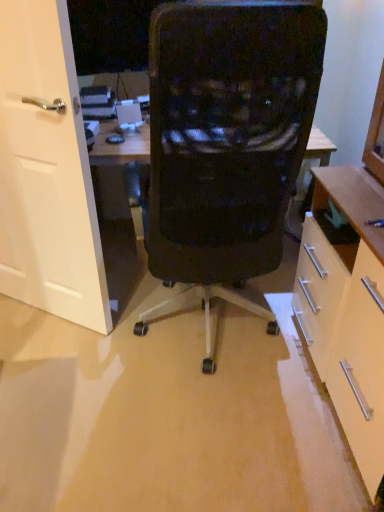
The width and height of the screenshot is (384, 512). What are the coordinates of `white matte door at left` in the screenshot? It's located at (46, 170).

Can we say black mesh chair at center lies outside matte white cabinet at right?

black mesh chair at center lies outside matte white cabinet at right's area.

Considering the positions of objects black mesh chair at center and matte white cabinet at right in the image provided, who is more to the left, black mesh chair at center or matte white cabinet at right?

black mesh chair at center.

From a real-world perspective, who is located lower, black mesh chair at center or matte white cabinet at right?

black mesh chair at center, from a real-world perspective.

Image resolution: width=384 pixels, height=512 pixels. In the image, there is a matte white cabinet at right. Identify the location of chair above it (from the image's perspective). (227, 140).

Is white matte door at left far from matte white cabinet at right?

No.

Can you confirm if white matte door at left is wider than matte white cabinet at right?

No, white matte door at left is not wider than matte white cabinet at right.

Which of these two, white matte door at left or matte white cabinet at right, stands shorter?

matte white cabinet at right is shorter.

Is white matte door at left facing away from matte white cabinet at right?

No, white matte door at left's orientation is not away from matte white cabinet at right.

Can you confirm if matte white cabinet at right is wider than white matte door at left?

Indeed, matte white cabinet at right has a greater width compared to white matte door at left.

From a real-world perspective, is matte white cabinet at right positioned over white matte door at left based on gravity?

Indeed, from a real-world perspective, matte white cabinet at right stands above white matte door at left.

The width and height of the screenshot is (384, 512). Find the location of `cabinetry on the right of white matte door at left`. cabinetry on the right of white matte door at left is located at coordinates (347, 308).

You are a GUI agent. You are given a task and a screenshot of the screen. Output one action in this format:
    pyautogui.click(x=<x>, y=<y>)
    Task: Click on the door that appears above the black mesh chair at center (from the image's perspective)
    The width and height of the screenshot is (384, 512).
    Given the screenshot: What is the action you would take?
    pyautogui.click(x=46, y=170)

From a real-world perspective, which is physically below, white matte door at left or black mesh chair at center?

white matte door at left is physically lower.

Can you tell me how much white matte door at left and black mesh chair at center differ in facing direction?

147 degrees.

Can you confirm if white matte door at left is shorter than black mesh chair at center?

Yes, white matte door at left is shorter than black mesh chair at center.

Considering the positions of points (262, 240) and (32, 193), is point (262, 240) closer to camera compared to point (32, 193)?

Yes, it is in front of point (32, 193).

Considering the sizes of objects black mesh chair at center and white matte door at left in the image provided, who is bigger, black mesh chair at center or white matte door at left?

Bigger between the two is black mesh chair at center.

From a real-world perspective, is black mesh chair at center physically above white matte door at left?

Yes.

How different are the orientations of matte white cabinet at right and black mesh chair at center in degrees?

The facing directions of matte white cabinet at right and black mesh chair at center are 89.3 degrees apart.

Is matte white cabinet at right thinner than black mesh chair at center?

Indeed, matte white cabinet at right has a lesser width compared to black mesh chair at center.

Looking at this image, is matte white cabinet at right facing towards black mesh chair at center?

Yes, matte white cabinet at right faces towards black mesh chair at center.

This screenshot has width=384, height=512. Identify the location of cabinetry located below the black mesh chair at center (from the image's perspective). (347, 308).

Find the location of a particular element. cabinetry located on the right of black mesh chair at center is located at coordinates (347, 308).

Locate an element on the screen. cabinetry lying in front of the white matte door at left is located at coordinates (347, 308).

Which object lies further to the anchor point white matte door at left, black mesh chair at center or matte white cabinet at right?

Based on the image, matte white cabinet at right appears to be further to white matte door at left.

Considering their positions, is black mesh chair at center positioned further to matte white cabinet at right than white matte door at left?

white matte door at left.

From the image, which object appears to be nearer to white matte door at left, matte white cabinet at right or black mesh chair at center?

Based on the image, black mesh chair at center appears to be nearer to white matte door at left.

From the image, which object appears to be farther from black mesh chair at center, matte white cabinet at right or white matte door at left?

The object further to black mesh chair at center is white matte door at left.

Estimate the real-world distances between objects in this image. Which object is closer to matte white cabinet at right, white matte door at left or black mesh chair at center?

Among the two, black mesh chair at center is located nearer to matte white cabinet at right.

From the image, which object appears to be nearer to black mesh chair at center, white matte door at left or matte white cabinet at right?

The object closer to black mesh chair at center is matte white cabinet at right.

Identify the location of chair between white matte door at left and matte white cabinet at right in the horizontal direction. This screenshot has height=512, width=384. (227, 140).